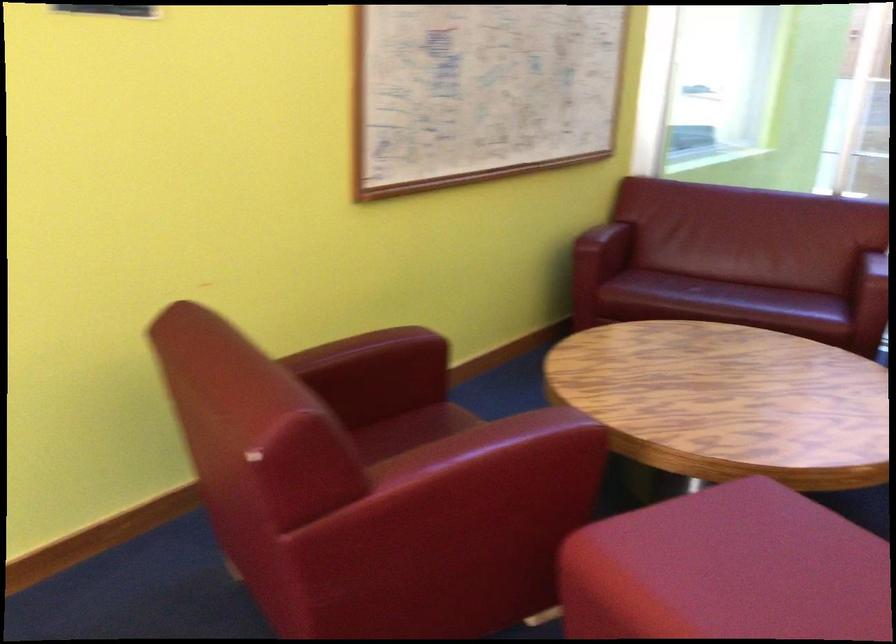
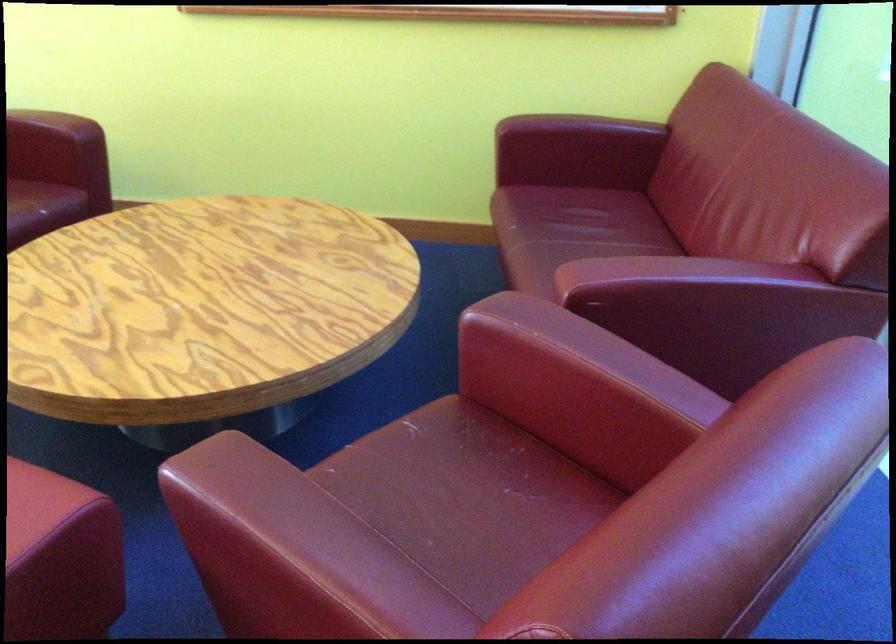
The point at (669,270) is marked in the first image. Where is the corresponding point in the second image?

(592, 210)